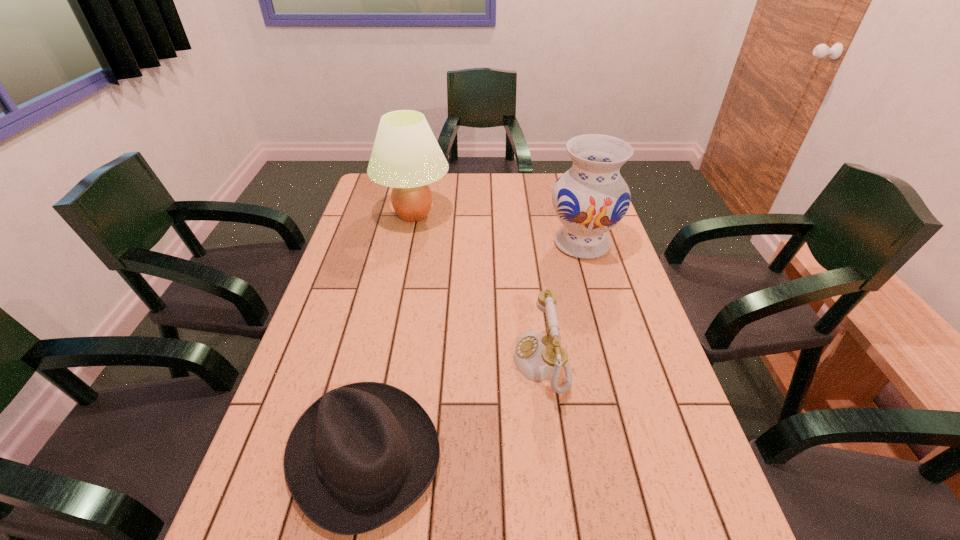
The image size is (960, 540). Identify the location of object present at the left edge. (406, 156).

Locate an element on the screen. The width and height of the screenshot is (960, 540). object at the right edge is located at coordinates (589, 199).

Image resolution: width=960 pixels, height=540 pixels. Identify the location of object at the far left corner. (406, 156).

In the image, there is a desktop. Identify the location of free space at the far edge. This screenshot has width=960, height=540. (514, 180).

Identify the location of free space at the left edge. (322, 332).

Find the location of a particular element. vacant space at the right edge is located at coordinates (602, 279).

Where is `free space at the far left corner of the desktop`? free space at the far left corner of the desktop is located at coordinates (378, 204).

Locate an element on the screen. The image size is (960, 540). vacant area between the vase and the lampshade is located at coordinates pyautogui.click(x=498, y=229).

Where is `free area in between the rightmost object and the third object from left to right`? This screenshot has height=540, width=960. free area in between the rightmost object and the third object from left to right is located at coordinates (562, 303).

At what (x,y) coordinates should I click in order to perform the action: click on vacant area that lies between the vase and the second object from right to left. Please return your answer as a coordinate pair (x, y). This screenshot has height=540, width=960. Looking at the image, I should click on click(562, 303).